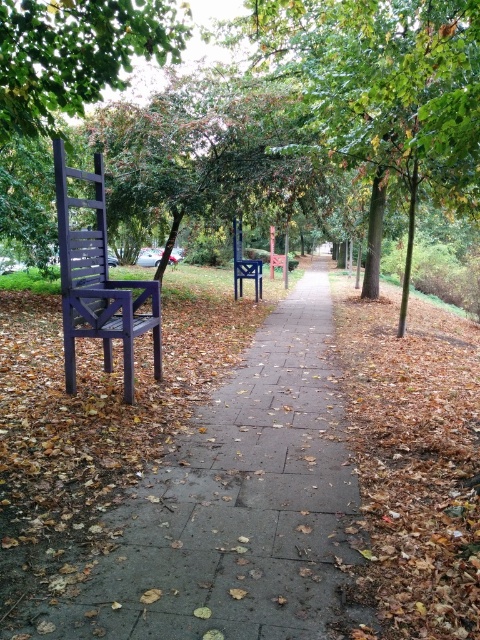
Does smooth concrete pavement at center have a greater height compared to green leafy tree at upper left?

Incorrect, smooth concrete pavement at center's height is not larger of green leafy tree at upper left's.

Which is below, smooth concrete pavement at center or green leafy tree at upper left?

smooth concrete pavement at center is lower down.

The width and height of the screenshot is (480, 640). I want to click on smooth concrete pavement at center, so click(230, 506).

Who is lower down, green leafy tree at upper left or matte purple chair at left?

matte purple chair at left is below.

Describe the element at coordinates (75, 54) in the screenshot. I see `green leafy tree at upper left` at that location.

You are a GUI agent. You are given a task and a screenshot of the screen. Output one action in this format:
    pyautogui.click(x=<x>, y=<y>)
    Task: Click on the green leafy tree at upper left
    Image resolution: width=480 pixels, height=640 pixels.
    Given the screenshot: What is the action you would take?
    pyautogui.click(x=75, y=54)

Is smooth concrete pavement at center bigger than matte purple chair at left?

Incorrect, smooth concrete pavement at center is not larger than matte purple chair at left.

The width and height of the screenshot is (480, 640). Describe the element at coordinates (230, 506) in the screenshot. I see `smooth concrete pavement at center` at that location.

Identify the location of smooth concrete pavement at center. The width and height of the screenshot is (480, 640). (230, 506).